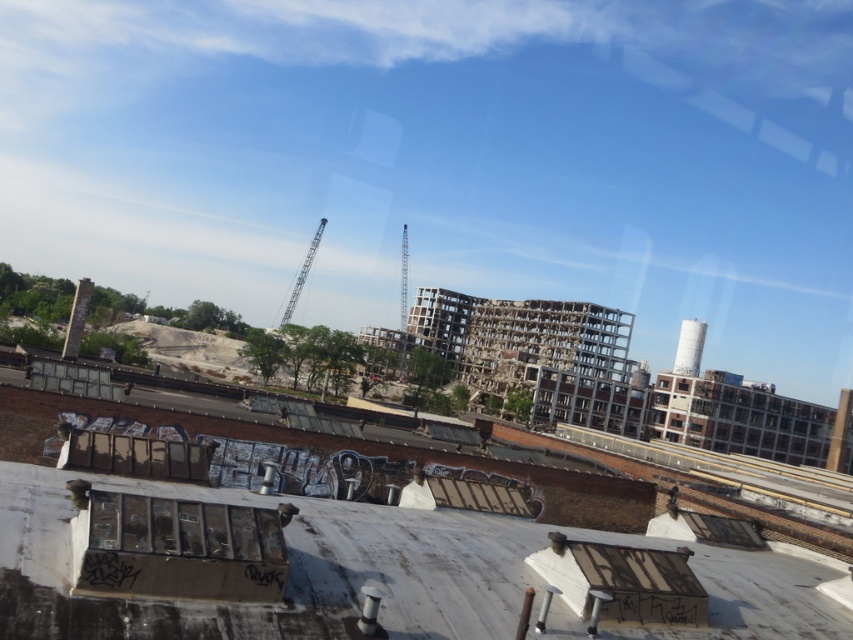
You are standing on the rooftop and looking at the point marked as point (x=202, y=500). What is the location of this point relative to the exposed concrete rubble at center?

The point (x=202, y=500) is located on the exposed concrete rubble at center.

You are a construction worker who needs to transport materials from the rooftop to the lower left area. You have a cart that can carry items up to the size of the metallic glass train window at lower left. Can you safely carry the exposed concrete rubble at center using this cart?

The exposed concrete rubble at center has a larger size compared to the metallic glass train window at lower left. Therefore, the cart cannot safely carry the exposed concrete rubble at center since it exceeds the maximum size capacity.